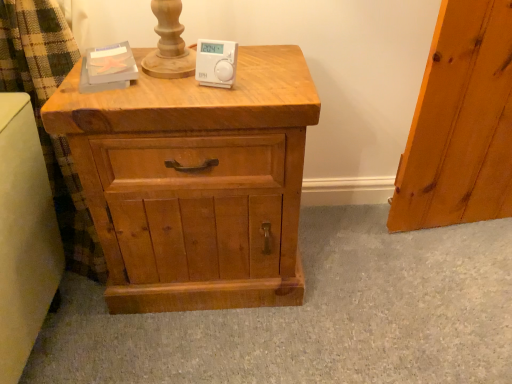
Locate an element on the screen. The height and width of the screenshot is (384, 512). vacant area in front of white plastic thermostat at center is located at coordinates (207, 94).